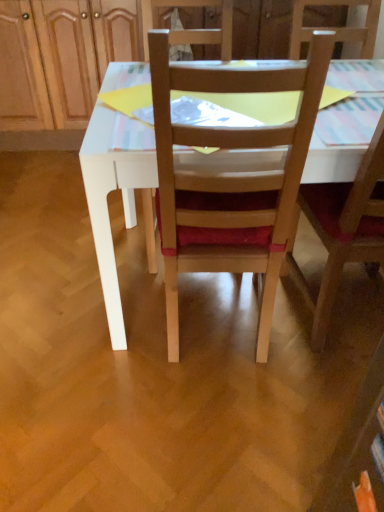
Question: Is wooden dresser at upper center bigger than wooden chair at center, positioned as the 1th chair in right-to-left order?

Choices:
 (A) no
 (B) yes

Answer: (B)

Question: Considering the relative positions of wooden dresser at upper center and wooden chair at center, the 2th chair from the left, in the image provided, is wooden dresser at upper center to the right of wooden chair at center, the 2th chair from the left, from the viewer's perspective?

Choices:
 (A) yes
 (B) no

Answer: (B)

Question: Is wooden dresser at upper center far from wooden chair at center, positioned as the 1th chair in right-to-left order?

Choices:
 (A) yes
 (B) no

Answer: (A)

Question: Is wooden chair at center, positioned as the 1th chair in right-to-left order, located within wooden dresser at upper center?

Choices:
 (A) yes
 (B) no

Answer: (B)

Question: Is wooden dresser at upper center further to camera compared to wooden chair at center, the 2th chair from the left?

Choices:
 (A) no
 (B) yes

Answer: (B)

Question: From the image's perspective, relative to wooden dresser at upper center, is wooden chair at center, acting as the first chair starting from the left, above or below?

Choices:
 (A) below
 (B) above

Answer: (A)

Question: Would you say wooden chair at center, the 2th chair viewed from the right, is inside or outside wooden dresser at upper center?

Choices:
 (A) inside
 (B) outside

Answer: (B)

Question: From a real-world perspective, is wooden chair at center, the 2th chair viewed from the right, positioned above or below wooden dresser at upper center?

Choices:
 (A) above
 (B) below

Answer: (A)

Question: Based on their sizes in the image, would you say wooden chair at center, acting as the first chair starting from the left, is bigger or smaller than wooden dresser at upper center?

Choices:
 (A) small
 (B) big

Answer: (A)

Question: Does point (329, 225) appear closer or farther from the camera than point (8, 108)?

Choices:
 (A) farther
 (B) closer

Answer: (B)

Question: In terms of height, does wooden chair at center, the 2th chair from the left, look taller or shorter compared to wooden dresser at upper center?

Choices:
 (A) tall
 (B) short

Answer: (A)

Question: In terms of size, does wooden chair at center, the 2th chair from the left, appear bigger or smaller than wooden dresser at upper center?

Choices:
 (A) small
 (B) big

Answer: (A)

Question: From the image's perspective, relative to wooden dresser at upper center, is wooden chair at center, the 2th chair from the left, above or below?

Choices:
 (A) below
 (B) above

Answer: (A)

Question: From the image's perspective, is wooden chair at center, acting as the first chair starting from the left, located above or below wooden chair at center, positioned as the 1th chair in right-to-left order?

Choices:
 (A) above
 (B) below

Answer: (B)

Question: From a real-world perspective, relative to wooden chair at center, positioned as the 1th chair in right-to-left order, is wooden chair at center, the 2th chair viewed from the right, vertically above or below?

Choices:
 (A) above
 (B) below

Answer: (B)